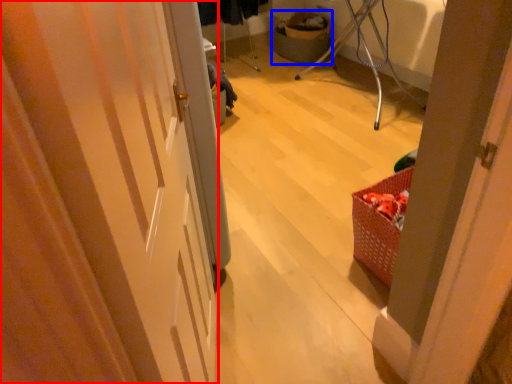
Question: Which object appears closest to the camera in this image, door (highlighted by a red box) or basket (highlighted by a blue box)?

Choices:
 (A) door
 (B) basket

Answer: (A)